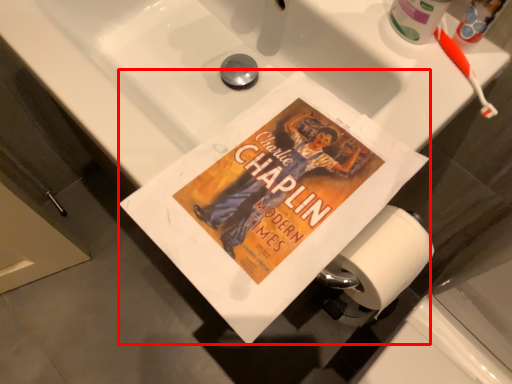
Question: From the image's perspective, where is paperback book (annotated by the red box) located relative to toothbrush?

Choices:
 (A) above
 (B) below

Answer: (B)